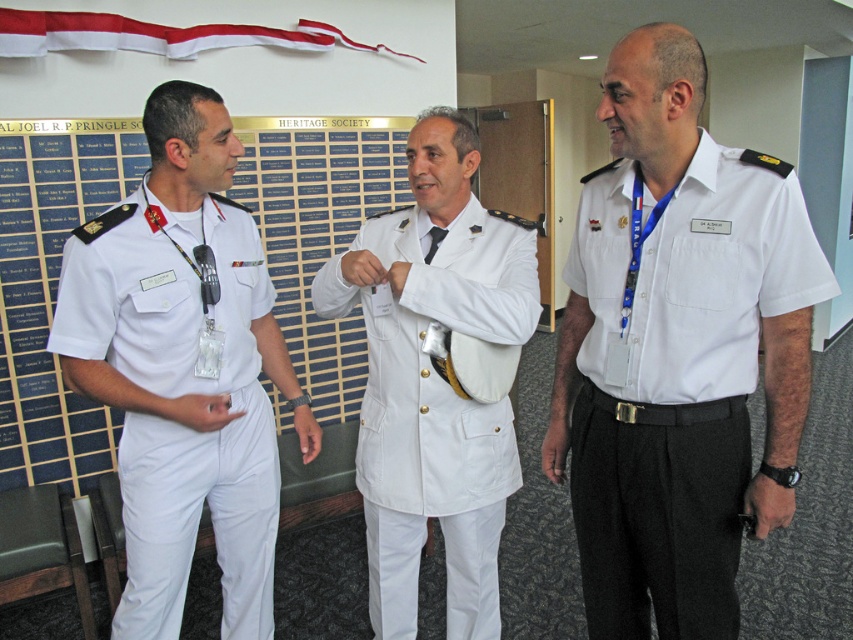
Question: Can you confirm if white matte uniform at left is positioned to the left of white fabric ribbon at upper center?

Choices:
 (A) no
 (B) yes

Answer: (A)

Question: Which point appears closest to the camera in this image?

Choices:
 (A) (462, 417)
 (B) (183, 371)
 (C) (169, 52)

Answer: (B)

Question: Which of the following is the farthest from the observer?

Choices:
 (A) white matte uniform at left
 (B) white matte uniform at center
 (C) white fabric ribbon at upper center

Answer: (C)

Question: Does white matte uniform at center have a lesser width compared to white fabric ribbon at upper center?

Choices:
 (A) yes
 (B) no

Answer: (A)

Question: Which of these objects is positioned farthest from the white fabric ribbon at upper center?

Choices:
 (A) white matte uniform at left
 (B) white cotton shirt at center
 (C) white matte uniform at center

Answer: (B)

Question: Is white matte uniform at left wider than white matte uniform at center?

Choices:
 (A) no
 (B) yes

Answer: (A)